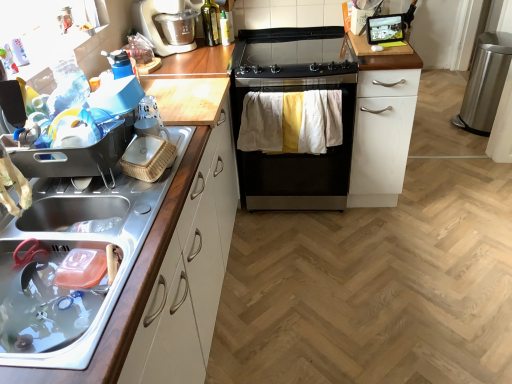
Question: From a real-world perspective, does white matte cabinet at center-right, the 2th cabinetry from the left, stand above translucent plastic spray bottle at upper center, placed as the 1th bottle when sorted from right to left?

Choices:
 (A) yes
 (B) no

Answer: (B)

Question: Does white matte cabinet at center-right, the 2th cabinetry from the left, have a greater width compared to translucent plastic spray bottle at upper center, placed as the 1th bottle when sorted from right to left?

Choices:
 (A) yes
 (B) no

Answer: (A)

Question: From a real-world perspective, is white matte cabinet at center-right, the 2th cabinetry in the front-to-back sequence, physically below translucent plastic spray bottle at upper center, the 2th bottle positioned from the left?

Choices:
 (A) yes
 (B) no

Answer: (A)

Question: Is translucent plastic spray bottle at upper center, the 2th bottle positioned from the left, completely or partially inside white matte cabinet at center-right, the 2th cabinetry from the left?

Choices:
 (A) yes
 (B) no

Answer: (B)

Question: Is white matte cabinet at center-right, the 2th cabinetry in the front-to-back sequence, with translucent plastic spray bottle at upper center, the 2th bottle positioned from the left?

Choices:
 (A) yes
 (B) no

Answer: (B)

Question: Does white matte cabinet at center-right, the 2th cabinetry from the left, come in front of translucent plastic spray bottle at upper center, placed as the 1th bottle when sorted from right to left?

Choices:
 (A) no
 (B) yes

Answer: (B)

Question: Is white matte cabinet at center-right, placed as the first cabinetry when sorted from back to front, completely or partially outside of green glass bottle at upper center, the 2th bottle viewed from the right?

Choices:
 (A) no
 (B) yes

Answer: (B)

Question: From a real-world perspective, is white matte cabinet at center-right, placed as the first cabinetry when sorted from back to front, on top of green glass bottle at upper center, the 2th bottle viewed from the right?

Choices:
 (A) no
 (B) yes

Answer: (A)

Question: Is white matte cabinet at center-right, the first cabinetry when ordered from right to left, closer to camera compared to green glass bottle at upper center, the 1th bottle viewed from the left?

Choices:
 (A) yes
 (B) no

Answer: (A)

Question: From the image's perspective, would you say white matte cabinet at center-right, placed as the first cabinetry when sorted from back to front, is positioned over green glass bottle at upper center, the 1th bottle viewed from the left?

Choices:
 (A) yes
 (B) no

Answer: (B)

Question: Is white matte cabinet at center-right, placed as the first cabinetry when sorted from back to front, behind green glass bottle at upper center, the 2th bottle viewed from the right?

Choices:
 (A) no
 (B) yes

Answer: (A)

Question: From a real-world perspective, is white matte cabinet at center-right, the 2th cabinetry from the left, physically below green glass bottle at upper center, the 2th bottle viewed from the right?

Choices:
 (A) yes
 (B) no

Answer: (A)

Question: From the image's perspective, is black stainless steel stove at center located above metallic sink at left, positioned as the second cabinetry in back-to-front order?

Choices:
 (A) yes
 (B) no

Answer: (A)